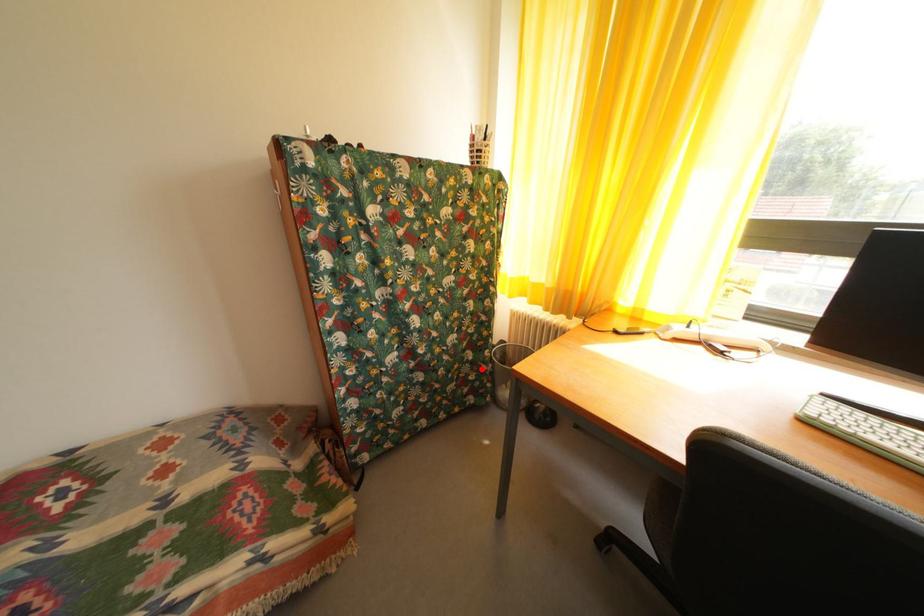
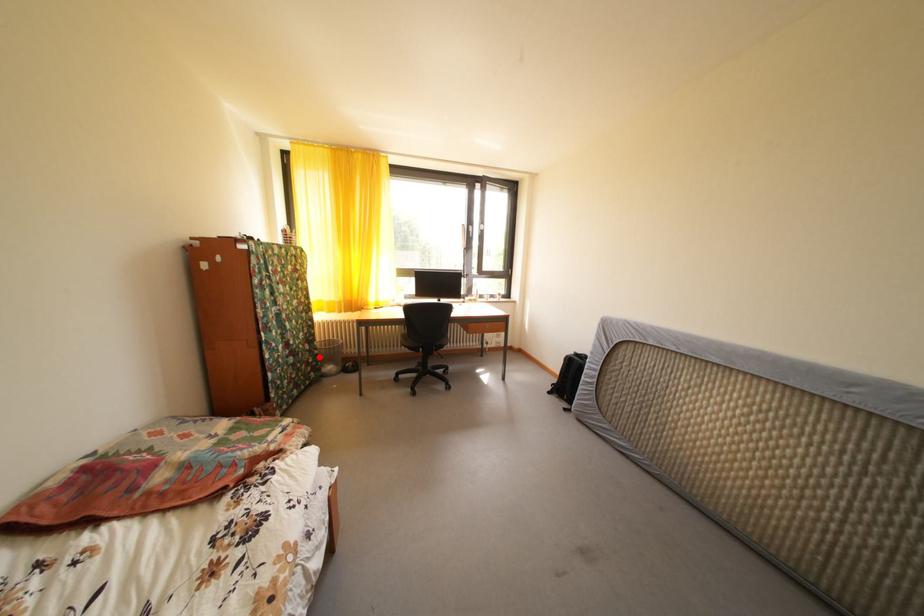
I am providing you with two images of the same scene from different viewpoints. A red point is marked on the first image and another point is marked on the second image. Are the points marked in image1 and image2 representing the same 3D position?

Yes